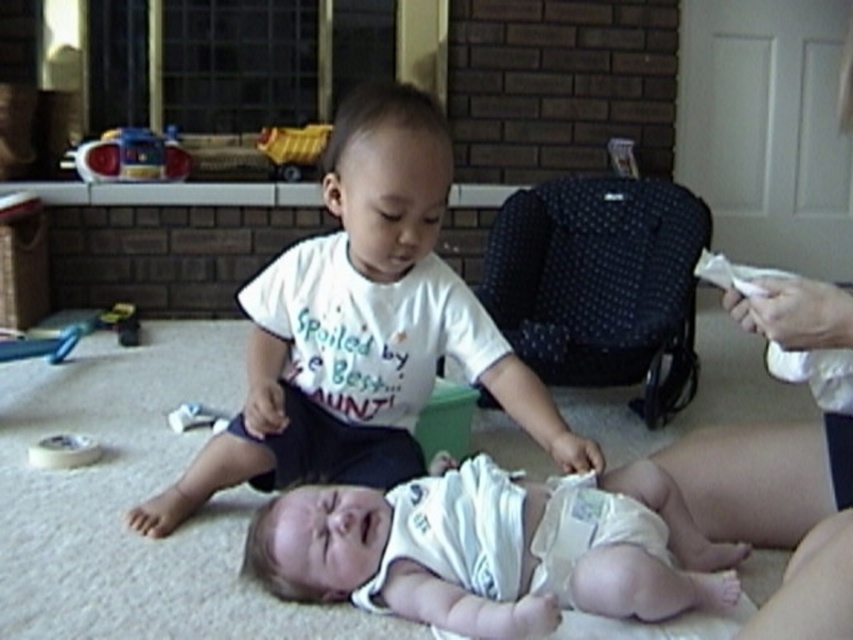
Question: Which object is closer to the camera taking this photo?

Choices:
 (A) white cloth diaper at center
 (B) yellow plastic toy at upper center
 (C) white matte tape at lower left

Answer: (A)

Question: Which point is closer to the camera taking this photo?

Choices:
 (A) (287, 141)
 (B) (471, 529)
 (C) (45, 461)
 (D) (201, 404)

Answer: (B)

Question: In this image, where is translucent plastic toy at upper left located relative to white plastic toy at lower left?

Choices:
 (A) left
 (B) right

Answer: (A)

Question: Which point appears closest to the camera in this image?

Choices:
 (A) (187, 417)
 (B) (102, 145)
 (C) (326, 131)
 (D) (563, 554)

Answer: (D)

Question: From the image, what is the correct spatial relationship of white cloth diaper at lower center in relation to white matte tape at lower left?

Choices:
 (A) left
 (B) right

Answer: (B)

Question: Considering the relative positions of white cloth diaper at center and white plastic toy at lower left in the image provided, where is white cloth diaper at center located with respect to white plastic toy at lower left?

Choices:
 (A) above
 (B) below

Answer: (B)